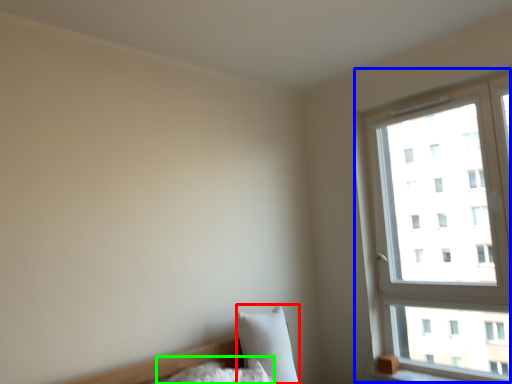
Question: Considering the real-world distances, which object is closest to pillow (highlighted by a red box)? window (highlighted by a blue box) or pillow (highlighted by a green box).

Choices:
 (A) window
 (B) pillow

Answer: (B)